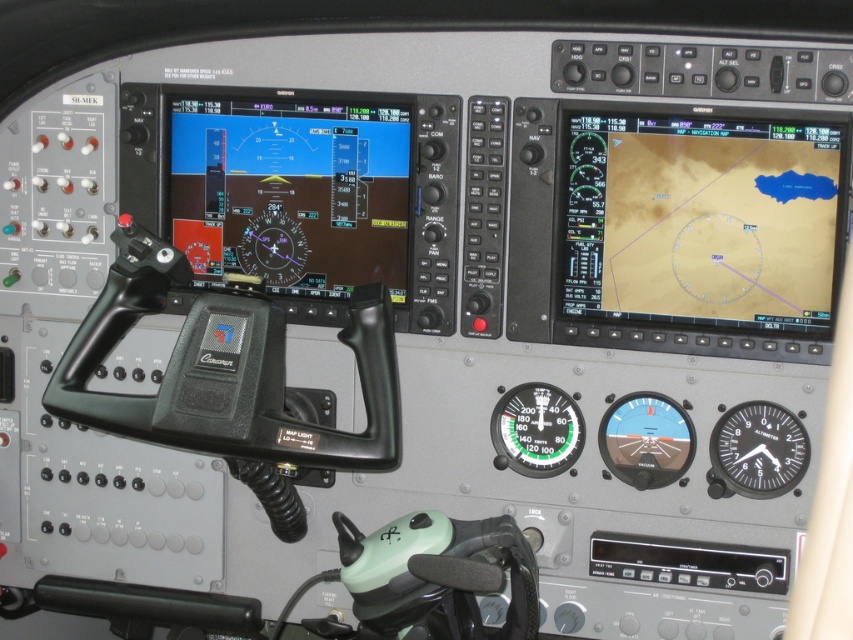
Question: Which point is farther to the camera?

Choices:
 (A) (567, 452)
 (B) (805, 460)
 (C) (628, 440)

Answer: (A)

Question: From the image, what is the correct spatial relationship of black glass altimeter at lower right in relation to transparent glass vacuum gauge at center?

Choices:
 (A) above
 (B) below

Answer: (B)

Question: Which point is closer to the camera taking this photo?

Choices:
 (A) (677, 406)
 (B) (778, 454)

Answer: (B)

Question: Can you confirm if black glass altimeter at lower right is positioned to the right of green matte gauge at center?

Choices:
 (A) no
 (B) yes

Answer: (B)

Question: Is black glass altimeter at lower right wider than transparent glass vacuum gauge at center?

Choices:
 (A) yes
 (B) no

Answer: (A)

Question: Which of the following is the farthest from the observer?

Choices:
 (A) (296, 234)
 (B) (799, 429)
 (C) (653, 472)

Answer: (A)